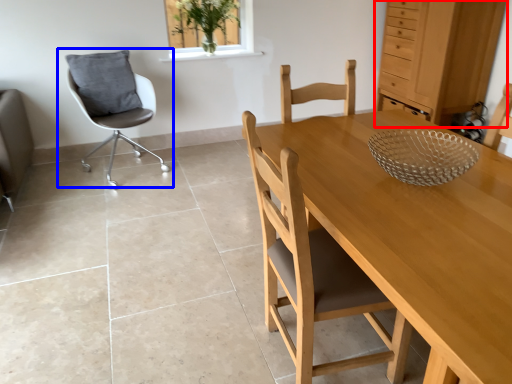
Question: Which object appears closest to the camera in this image, dresser (highlighted by a red box) or chair (highlighted by a blue box)?

Choices:
 (A) dresser
 (B) chair

Answer: (B)